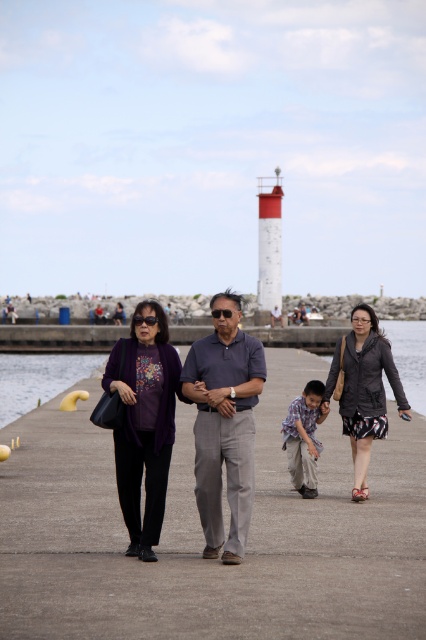
Question: Is yellow rubber duck at lower left positioned before light brown cotton shirt at center?

Choices:
 (A) yes
 (B) no

Answer: (B)

Question: Which is farther from the yellow rubber duck at lower left?

Choices:
 (A) gray cotton shirt at center
 (B) dark gray textured jacket at center

Answer: (A)

Question: Does dark gray textured jacket at center appear over light brown cotton shirt at center?

Choices:
 (A) no
 (B) yes

Answer: (B)

Question: Observing the image, what is the correct spatial positioning of gray cotton shirt at center in reference to yellow rubber duck at lower left?

Choices:
 (A) right
 (B) left

Answer: (A)

Question: Which point appears farthest from the camera in this image?

Choices:
 (A) (408, 412)
 (B) (215, 362)
 (C) (310, 380)
 (D) (123, 451)

Answer: (C)

Question: Among these objects, which one is farthest from the camera?

Choices:
 (A) yellow rubber duck at lower left
 (B) gray cotton shirt at center
 (C) dark gray textured jacket at center

Answer: (A)